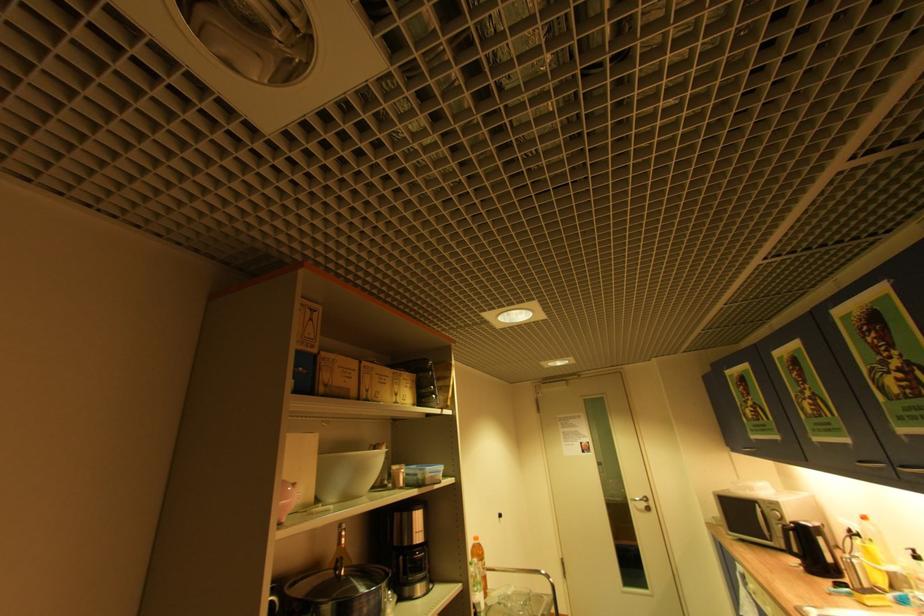
Locate an element on the screen. The width and height of the screenshot is (924, 616). black kettle handle is located at coordinates (791, 539).